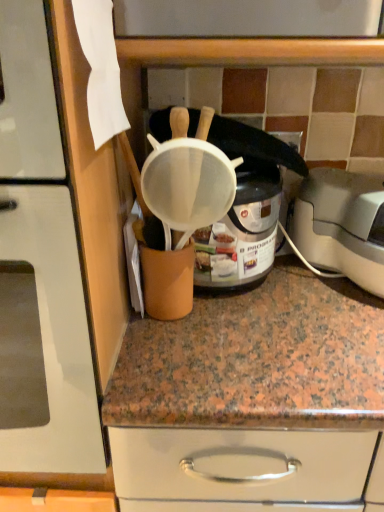
Locate an element on the screen. The height and width of the screenshot is (512, 384). white mesh strainer at center is located at coordinates (248, 203).

Where is `white mesh strainer at center`? The width and height of the screenshot is (384, 512). white mesh strainer at center is located at coordinates (248, 203).

Where is `home appliance on the left of white plastic toaster at right`? The width and height of the screenshot is (384, 512). home appliance on the left of white plastic toaster at right is located at coordinates (44, 256).

Is white plastic toaster at right a part of matte white strainer at upper center?

Definitely not — white plastic toaster at right is not inside matte white strainer at upper center.

Which is more to the right, matte white strainer at upper center or white plastic toaster at right?

Positioned to the right is white plastic toaster at right.

Does white mesh strainer at center have a larger size compared to matte white strainer at upper center?

No.

From the image's perspective, between white mesh strainer at center and matte white strainer at upper center, who is located below?

matte white strainer at upper center is shown below in the image.

Is white mesh strainer at center not within matte white strainer at upper center?

white mesh strainer at center is positioned outside matte white strainer at upper center.

From a real-world perspective, which is physically below, white mesh strainer at center or matte white strainer at upper center?

white mesh strainer at center, from a real-world perspective.

Is matte white strainer at upper center placed right next to white mesh strainer at center?

No, matte white strainer at upper center is not with white mesh strainer at center.

Is matte white strainer at upper center further to camera compared to white mesh strainer at center?

No, it is in front of white mesh strainer at center.

From the image's perspective, is matte white strainer at upper center beneath white mesh strainer at center?

Yes.

Is matte white strainer at upper center inside the boundaries of white mesh strainer at center, or outside?

matte white strainer at upper center exists outside the volume of white mesh strainer at center.

Would you say white plastic toaster at right contains matte white strainer at upper center?

Actually, matte white strainer at upper center is outside white plastic toaster at right.

Between white plastic toaster at right and matte white strainer at upper center, which one has less height?

white plastic toaster at right.

In the scene shown: Considering the positions of objects white plastic toaster at right and matte white strainer at upper center in the image provided, who is behind, white plastic toaster at right or matte white strainer at upper center?

white plastic toaster at right is further from the camera.

Is white plastic toaster at right with matte white strainer at upper center?

No, white plastic toaster at right is not making contact with matte white strainer at upper center.

Is white mesh strainer at center completely or partially outside of white plastic toaster at right?

white mesh strainer at center is positioned outside white plastic toaster at right.

Where is `appliance above the white plastic toaster at right (from a real-world perspective)`? The width and height of the screenshot is (384, 512). appliance above the white plastic toaster at right (from a real-world perspective) is located at coordinates (248, 203).

From the image's perspective, between white mesh strainer at center and white plastic toaster at right, who is located below?

white plastic toaster at right is shown below in the image.

Measure the distance between white mesh strainer at center and white plastic toaster at right.

They are 6.70 inches apart.

How different are the orientations of white plastic toaster at right and white mesh strainer at center in degrees?

The angle between the facing direction of white plastic toaster at right and the facing direction of white mesh strainer at center is 0.000786 degrees.

Based on the photo, would you say white plastic toaster at right is to the left or to the right of white mesh strainer at center in the picture?

Clearly, white plastic toaster at right is on the right of white mesh strainer at center in the image.

Based on the photo, relative to white mesh strainer at center, is white plastic toaster at right in front or behind?

Visually, white plastic toaster at right is located behind white mesh strainer at center.

Is white mesh strainer at center inside white plastic toaster at right?

No, white mesh strainer at center is located outside of white plastic toaster at right.

Locate an element on the screen. The image size is (384, 512). home appliance lying above the white plastic toaster at right (from the image's perspective) is located at coordinates (44, 256).

I want to click on appliance on the right of matte white strainer at upper center, so click(248, 203).

When comparing their distances from white mesh strainer at center, does matte white strainer at upper center or white plastic toaster at right seem closer?

white plastic toaster at right is positioned closer to the anchor white mesh strainer at center.

Consider the image. When comparing their distances from white plastic toaster at right, does white mesh strainer at center or matte white strainer at upper center seem further?

The object further to white plastic toaster at right is matte white strainer at upper center.

Considering their positions, is matte white strainer at upper center positioned further to white plastic toaster at right than white mesh strainer at center?

Among the two, matte white strainer at upper center is located further to white plastic toaster at right.

Based on their spatial positions, is white mesh strainer at center or white plastic toaster at right closer to matte white strainer at upper center?

white mesh strainer at center.

Based on their spatial positions, is white plastic toaster at right or matte white strainer at upper center further from white mesh strainer at center?

Based on the image, matte white strainer at upper center appears to be further to white mesh strainer at center.

Based on the photo, considering their positions, is white plastic toaster at right positioned further to matte white strainer at upper center than white mesh strainer at center?

white plastic toaster at right is positioned further to the anchor matte white strainer at upper center.

Where is `appliance located between matte white strainer at upper center and white plastic toaster at right in the left-right direction`? The image size is (384, 512). appliance located between matte white strainer at upper center and white plastic toaster at right in the left-right direction is located at coordinates (248, 203).